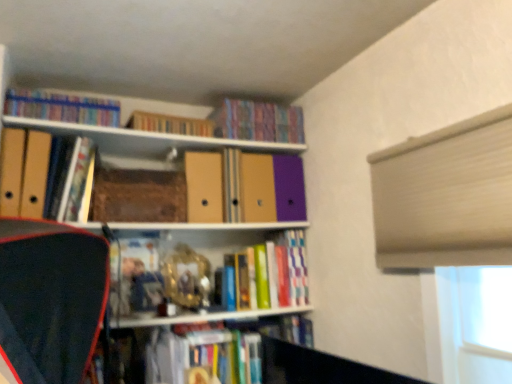
Question: Is the position of hardcover book at upper center, the fifth book ordered from the bottom, less distant than that of brown matte paper at center, which is counted as the 1th paperback book, starting from the right?

Choices:
 (A) yes
 (B) no

Answer: (B)

Question: Can you confirm if hardcover book at upper center, the fifth book ordered from the bottom, is smaller than brown matte paper at center, the 2th paperback book when ordered from front to back?

Choices:
 (A) yes
 (B) no

Answer: (A)

Question: Would you say hardcover book at upper center, the fifth book ordered from the bottom, contains brown matte paper at center, the 2th paperback book when ordered from front to back?

Choices:
 (A) yes
 (B) no

Answer: (B)

Question: Is hardcover book at upper center, the fifth book ordered from the bottom, looking in the opposite direction of brown matte paper at center, which is the 1th paperback book from back to front?

Choices:
 (A) no
 (B) yes

Answer: (A)

Question: Does hardcover book at upper center, the 3th book when ordered from top to bottom, have a lesser width compared to brown matte paper at center, which is counted as the 1th paperback book, starting from the right?

Choices:
 (A) no
 (B) yes

Answer: (B)

Question: Considering their positions, is hardcover books at center, the sixth book viewed from the top, located in front of or behind matte cardboard folder at center, marked as the 3th book in a bottom-to-top arrangement?

Choices:
 (A) behind
 (B) front

Answer: (A)

Question: Is point (239, 266) positioned closer to the camera than point (298, 157)?

Choices:
 (A) closer
 (B) farther

Answer: (A)

Question: Considering the positions of hardcover books at center, the sixth book viewed from the top, and matte cardboard folder at center, marked as the 3th book in a bottom-to-top arrangement, in the image, is hardcover books at center, the sixth book viewed from the top, taller or shorter than matte cardboard folder at center, marked as the 3th book in a bottom-to-top arrangement,?

Choices:
 (A) tall
 (B) short

Answer: (A)

Question: Would you say hardcover books at center, the sixth book viewed from the top, is to the left or to the right of matte cardboard folder at center, which is the 5th book in top-to-bottom order, in the picture?

Choices:
 (A) right
 (B) left

Answer: (A)

Question: From the image's perspective, relative to matte purple book at upper center, placed as the 6th book when sorted from bottom to top, is hardcover books at upper left, which is the 7th book from bottom to top, above or below?

Choices:
 (A) above
 (B) below

Answer: (A)

Question: In terms of height, does hardcover books at upper left, which is the 7th book from bottom to top, look taller or shorter compared to matte purple book at upper center, placed as the 6th book when sorted from bottom to top?

Choices:
 (A) tall
 (B) short

Answer: (B)

Question: In the image, is hardcover books at upper left, which is the 7th book from bottom to top, positioned in front of or behind matte purple book at upper center, placed as the 6th book when sorted from bottom to top?

Choices:
 (A) front
 (B) behind

Answer: (A)

Question: Is hardcover books at upper left, which is the 7th book from bottom to top, to the left or to the right of matte purple book at upper center, which ranks as the second book in top-to-bottom order, in the image?

Choices:
 (A) left
 (B) right

Answer: (A)

Question: From the image's perspective, is matte purple book at upper center, which ranks as the second book in top-to-bottom order, above or below hardcover books at upper left, which is counted as the first book, starting from the top?

Choices:
 (A) above
 (B) below

Answer: (B)

Question: Considering their positions, is matte purple book at upper center, which ranks as the second book in top-to-bottom order, located in front of or behind hardcover books at upper left, which is counted as the first book, starting from the top?

Choices:
 (A) behind
 (B) front

Answer: (A)